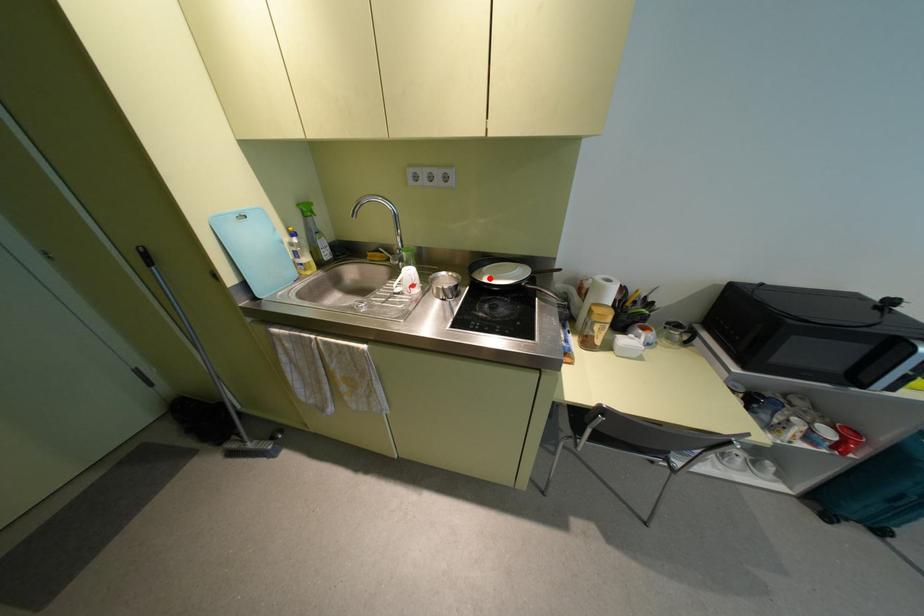
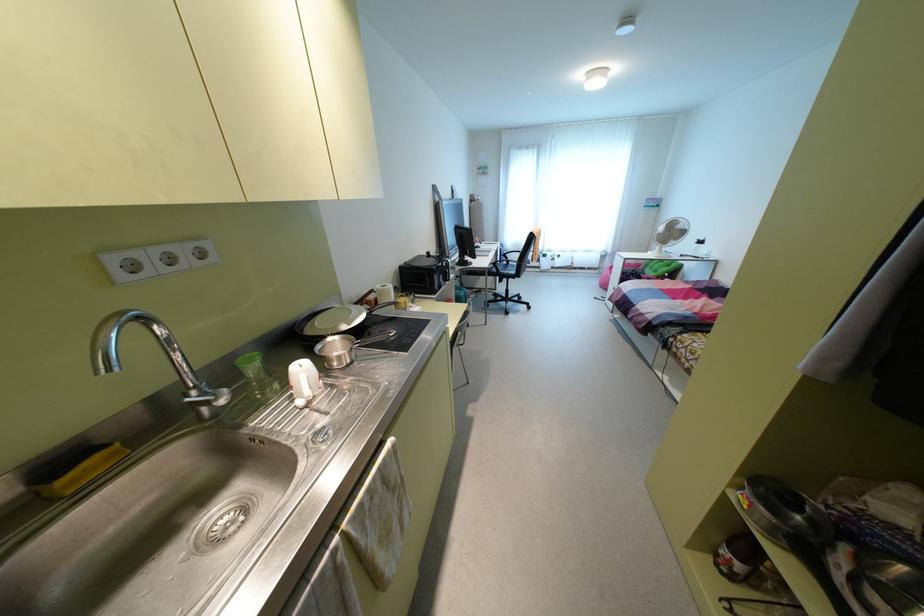
Where in the second image is the point corresponding to the highlighted location from the first image?

(348, 323)